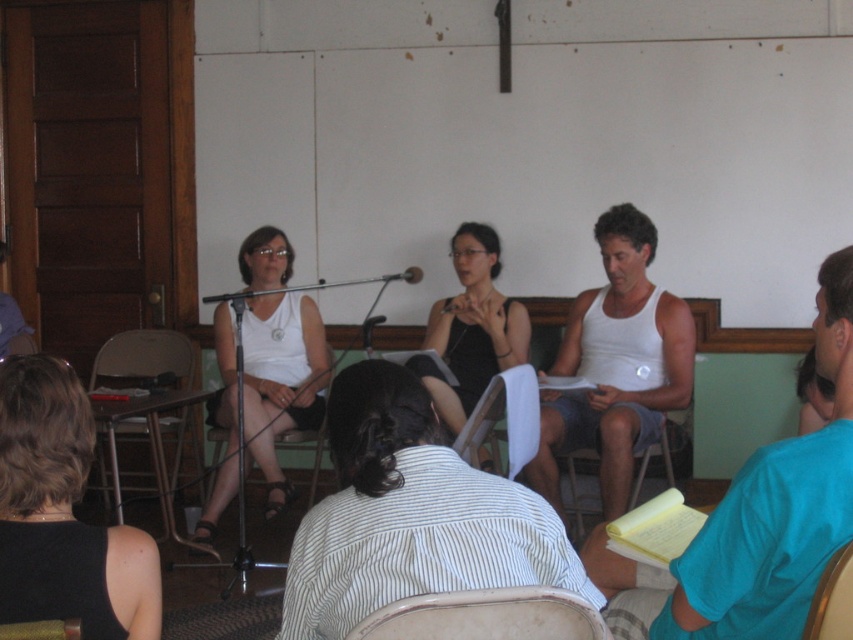
In the scene shown: Does white matte tank top at center have a greater height compared to wooden chair at lower left?

Correct, white matte tank top at center is much taller as wooden chair at lower left.

Measure the distance from white matte tank top at center to wooden chair at lower left.

The distance of white matte tank top at center from wooden chair at lower left is 9.53 feet.

Does point (271, 508) come closer to viewer compared to point (62, 627)?

No, it is behind (62, 627).

At what (x,y) coordinates should I click in order to perform the action: click on white matte tank top at center. Please return your answer as a coordinate pair (x, y). The height and width of the screenshot is (640, 853). Looking at the image, I should click on click(281, 380).

Between white matte tank top at center and black fabric dress at center, which one appears on the left side from the viewer's perspective?

Positioned to the left is white matte tank top at center.

Who is higher up, white matte tank top at center or black fabric dress at center?

black fabric dress at center is above.

Between point (264, 429) and point (456, 378), which one is positioned in front?

Point (456, 378) is more forward.

Where is `white matte tank top at center`? The height and width of the screenshot is (640, 853). white matte tank top at center is located at coordinates (281, 380).

Can you confirm if black fabric hair at lower left is shorter than metallic silver microphone at center?

No.

Does point (57, 461) come in front of point (419, 278)?

Yes.

The width and height of the screenshot is (853, 640). What are the coordinates of `black fabric hair at lower left` in the screenshot? It's located at (62, 515).

At what (x,y) coordinates should I click in order to perform the action: click on black fabric hair at lower left. Please return your answer as a coordinate pair (x, y). This screenshot has height=640, width=853. Looking at the image, I should click on (62, 515).